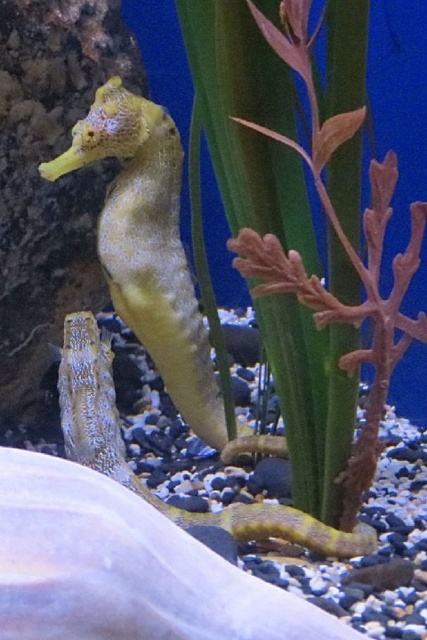
You are an aquarium caretaker who needs to clean the tank. You have a small net that can only handle objects wider than 10 cm. Based on the scene, can you safely use the net to remove the green matte plant at center without disturbing the shiny blue seahorse at center?

The green matte plant at center is thinner than the shiny blue seahorse at center. Since the net can handle objects wider than 10 cm, and the plant is thinner than the seahorse, it is likely narrower than 10 cm. Therefore, using the net might not be safe as it could disturb the seahorse if the plant is too narrow for the net to grasp properly without contact.